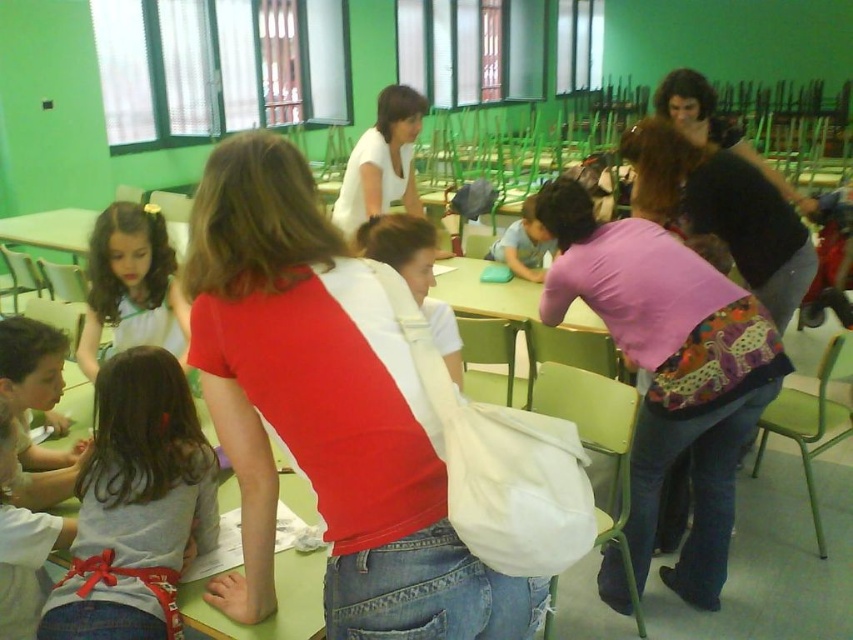
Is green plastic table at center further to camera compared to matte blue pencil case at center?

Yes, green plastic table at center is further from the viewer.

Is point (567, 364) farther from viewer compared to point (515, 243)?

That is False.

Is point (509, 294) more distant than point (505, 234)?

No, it is not.

The width and height of the screenshot is (853, 640). In order to click on green plastic table at center in this screenshot , I will do 488,296.

Who is higher up, light gray fabric shirt at center or matte blue pencil case at center?

matte blue pencil case at center

Which is more to the left, light gray fabric shirt at center or matte blue pencil case at center?

From the viewer's perspective, light gray fabric shirt at center appears more on the left side.

Locate an element on the screen. light gray fabric shirt at center is located at coordinates (136, 506).

What are the coordinates of `light gray fabric shirt at center` in the screenshot? It's located at (136, 506).

What do you see at coordinates (669, 369) in the screenshot? Image resolution: width=853 pixels, height=640 pixels. I see `pink fabric shirt at center` at bounding box center [669, 369].

Who is more forward, (578, 218) or (505, 262)?

Point (578, 218)

Between point (722, 364) and point (512, 234), which one is positioned in front?

Point (722, 364)

You are a GUI agent. You are given a task and a screenshot of the screen. Output one action in this format:
    pyautogui.click(x=<x>, y=<y>)
    Task: Click on the pink fabric shirt at center
    The height and width of the screenshot is (640, 853).
    Given the screenshot: What is the action you would take?
    pyautogui.click(x=669, y=369)